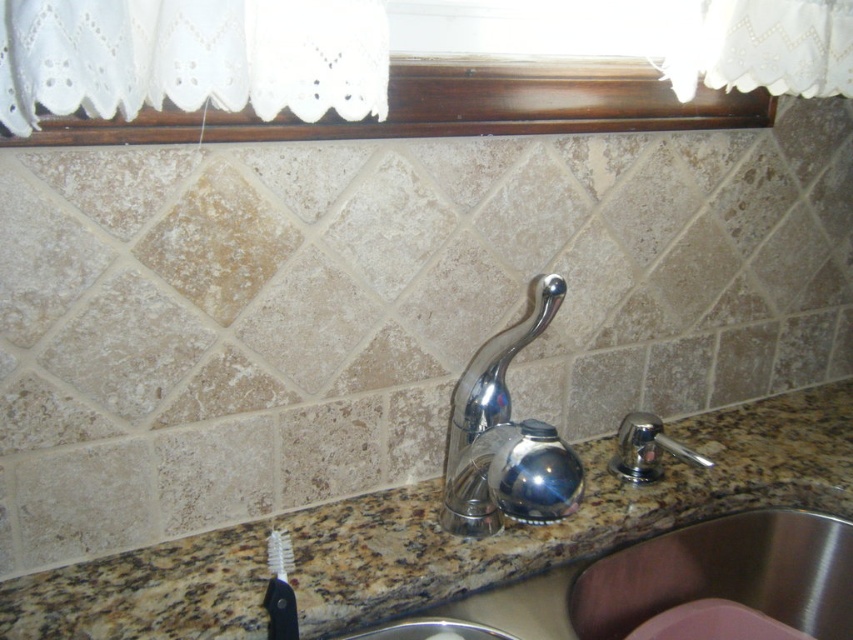
You are standing in front of the kitchen countertop. There is a dark wood window sill at upper center marked by point (450, 108). If you want to place a small herb pot on the countertop, where should you position it relative to the dark wood window sill at upper center to ensure it gets maximum sunlight?

The dark wood window sill at upper center is located at point (450, 108). To get maximum sunlight, the herb pot should be placed directly below the window sill, which would be to the lower part of the countertop near the sink.

You are a plumber checking the kitchen layout. You need to install a new faucet that must be at least 12 inches wide. Based on the current setup, can the polished chrome faucet at right fit a replacement that meets this requirement if the stainless steel sink at lower right is 18 inches wide?

The stainless steel sink at lower right is wider than the polished chrome faucet at right. Since the sink is 18 inches wide, the faucet, being narrower, would need to be replaced with one that is at least 12 inches wide. However, the sink size does not directly determine the faucet width requirement. The existing faucet might already meet the requirement, but without its specific measurement, we can only confirm the sink is wide enough to accommodate a 12 inch faucet if needed.

You are organizing a small plant on the kitchen countertop. You want to place it between the dark wood window sill at upper center and the white bristle toothbrush at lower left. Can you fit the plant in that space?

The dark wood window sill at upper center is to the right of the white bristle toothbrush at lower left, so there is space between them to place the plant.